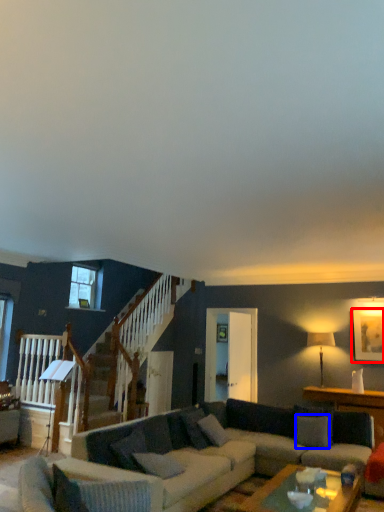
Question: Among these objects, which one is farthest to the camera, picture frame (highlighted by a red box) or pillow (highlighted by a blue box)?

Choices:
 (A) picture frame
 (B) pillow

Answer: (A)